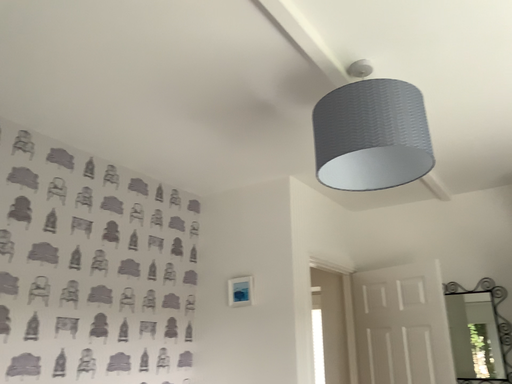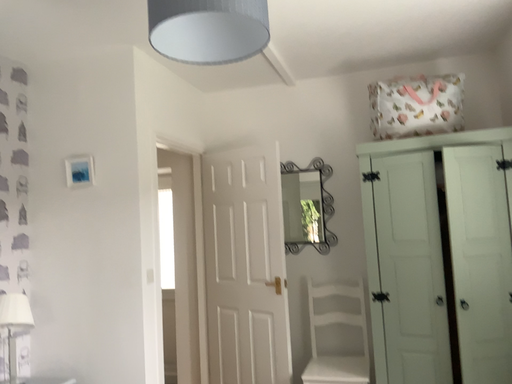
Question: How did the camera likely rotate when shooting the video?

Choices:
 (A) rotated left
 (B) rotated right

Answer: (B)